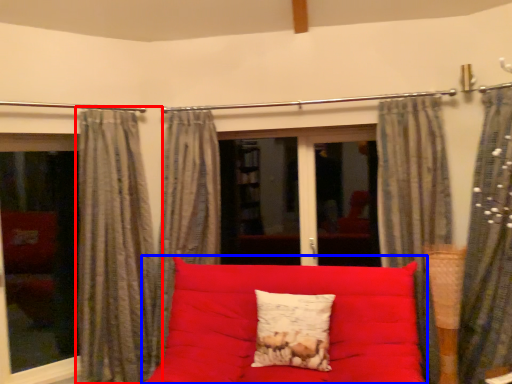
Question: Which object appears farthest to the camera in this image, curtain (highlighted by a red box) or studio couch (highlighted by a blue box)?

Choices:
 (A) curtain
 (B) studio couch

Answer: (A)